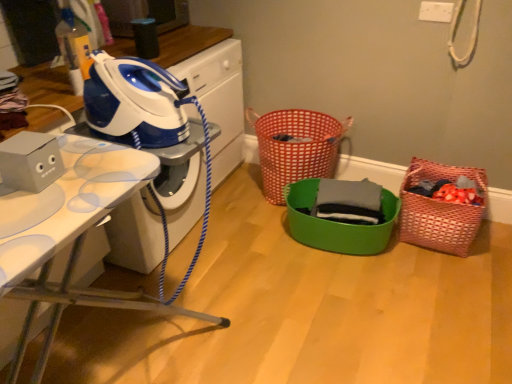
Measure the distance between point (439, 239) and camera.

They are 2.10 meters apart.

This screenshot has height=384, width=512. Describe the element at coordinates (440, 210) in the screenshot. I see `woven pink basket at right, positioned as the 1th basket in right-to-left order` at that location.

Describe the element at coordinates (29, 162) in the screenshot. I see `gray matte cardboard box at left, the 2th appliance in the back-to-front sequence` at that location.

What do you see at coordinates (295, 147) in the screenshot? I see `red woven basket at center, the first basket in the left-to-right sequence` at bounding box center [295, 147].

You are a GUI agent. You are given a task and a screenshot of the screen. Output one action in this format:
    pyautogui.click(x=<x>, y=<y>)
    Task: Click on the green plastic basket at center, marked as the 2th basket in a left-to-right arrangement
    The image size is (512, 384).
    Given the screenshot: What is the action you would take?
    pyautogui.click(x=336, y=223)

What is the approximate height of green plastic basket at center, which is the 2th basket from right to left?

11.14 inches.

The height and width of the screenshot is (384, 512). What do you see at coordinates (219, 100) in the screenshot?
I see `blue glossy iron at left` at bounding box center [219, 100].

Image resolution: width=512 pixels, height=384 pixels. Identify the location of blue glossy iron at left. (219, 100).

At what (x,y) coordinates should I click in order to perform the action: click on woven pink basket at right, positioned as the 1th basket in right-to-left order. Please return your answer as a coordinate pair (x, y). Looking at the image, I should click on (440, 210).

Does green plastic basket at center, marked as the 2th basket in a left-to-right arrangement, turn towards blue/white plastic iron at upper left, which appears as the first appliance when viewed from the top?

No, green plastic basket at center, marked as the 2th basket in a left-to-right arrangement, is not oriented towards blue/white plastic iron at upper left, which appears as the first appliance when viewed from the top.

How many degrees apart are the facing directions of green plastic basket at center, which is the 2th basket from right to left, and blue/white plastic iron at upper left, which appears as the 2th appliance when ordered from the bottom?

They differ by 85.5 degrees in their facing directions.

Between point (341, 234) and point (140, 86), which one is positioned in front?

Point (140, 86)

Does green plastic basket at center, which is the 2th basket from right to left, appear on the right side of blue/white plastic iron at upper left, which appears as the first appliance when viewed from the top?

Yes.

Can you confirm if woven pink basket at right, positioned as the 1th basket in right-to-left order, is smaller than gray cotton shirt at center?

Actually, woven pink basket at right, positioned as the 1th basket in right-to-left order, might be larger than gray cotton shirt at center.

Is woven pink basket at right, the third basket viewed from the left, positioned before gray cotton shirt at center?

Yes, it is in front of gray cotton shirt at center.

Looking at this image, are woven pink basket at right, the third basket viewed from the left, and gray cotton shirt at center making contact?

No, woven pink basket at right, the third basket viewed from the left, is not in contact with gray cotton shirt at center.

Is woven pink basket at right, positioned as the 1th basket in right-to-left order, positioned with its back to gray cotton shirt at center?

woven pink basket at right, positioned as the 1th basket in right-to-left order, is not turned away from gray cotton shirt at center.

Considering the points (362, 219) and (333, 222), which point is behind, point (362, 219) or point (333, 222)?

Point (333, 222)

Is gray cotton shirt at center to the left or to the right of green plastic basket at center, which is the 2th basket from right to left, in the image?

In the image, gray cotton shirt at center appears on the right side of green plastic basket at center, which is the 2th basket from right to left.

Between gray cotton shirt at center and green plastic basket at center, which is the 2th basket from right to left, which one is positioned behind?

Positioned behind is gray cotton shirt at center.

Can you confirm if gray cotton shirt at center is smaller than green plastic basket at center, marked as the 2th basket in a left-to-right arrangement?

Yes, gray cotton shirt at center is smaller than green plastic basket at center, marked as the 2th basket in a left-to-right arrangement.

At what (x,y) coordinates should I click in order to perform the action: click on washing machine behind the green plastic basket at center, marked as the 2th basket in a left-to-right arrangement. Please return your answer as a coordinate pair (x, y). This screenshot has height=384, width=512. Looking at the image, I should click on tap(219, 100).

From a real-world perspective, which object rests below the other?

green plastic basket at center, which is the 2th basket from right to left.

Which object is closer to the camera taking this photo, green plastic basket at center, which is the 2th basket from right to left, or blue glossy iron at left?

green plastic basket at center, which is the 2th basket from right to left, is more forward.

Is green plastic basket at center, marked as the 2th basket in a left-to-right arrangement, not near blue glossy iron at left?

No, green plastic basket at center, marked as the 2th basket in a left-to-right arrangement, is not far from blue glossy iron at left.

The width and height of the screenshot is (512, 384). What are the coordinates of `the 1st basket in front of the red woven basket at center, the third basket positioned from the right, counting from the anchor's position` in the screenshot? It's located at (440, 210).

Is red woven basket at center, the third basket positioned from the right, at the left side of woven pink basket at right, positioned as the 1th basket in right-to-left order?

Indeed, red woven basket at center, the third basket positioned from the right, is positioned on the left side of woven pink basket at right, positioned as the 1th basket in right-to-left order.

From the image's perspective, which object appears higher, gray matte cardboard box at left, the 2th appliance from the top, or woven pink basket at right, positioned as the 1th basket in right-to-left order?

gray matte cardboard box at left, the 2th appliance from the top, from the image's perspective.

Looking at this image, would you say woven pink basket at right, the third basket viewed from the left, is part of gray matte cardboard box at left, the 2th appliance in the back-to-front sequence,'s contents?

No, woven pink basket at right, the third basket viewed from the left, is not inside gray matte cardboard box at left, the 2th appliance in the back-to-front sequence.

Considering the relative sizes of gray matte cardboard box at left, the 1th appliance when ordered from front to back, and woven pink basket at right, positioned as the 1th basket in right-to-left order, in the image provided, is gray matte cardboard box at left, the 1th appliance when ordered from front to back, shorter than woven pink basket at right, positioned as the 1th basket in right-to-left order,?

Yes, gray matte cardboard box at left, the 1th appliance when ordered from front to back, is shorter than woven pink basket at right, positioned as the 1th basket in right-to-left order.

Who is bigger, gray matte cardboard box at left, the 2th appliance from the top, or woven pink basket at right, positioned as the 1th basket in right-to-left order?

Bigger between the two is woven pink basket at right, positioned as the 1th basket in right-to-left order.

Which of these two, blue/white plastic iron at upper left, which appears as the 2th appliance when ordered from the bottom, or white glossy ironing board at left, is thinner?

blue/white plastic iron at upper left, which appears as the 2th appliance when ordered from the bottom, is thinner.

From a real-world perspective, which is physically above, blue/white plastic iron at upper left, positioned as the 1th appliance in back-to-front order, or white glossy ironing board at left?

blue/white plastic iron at upper left, positioned as the 1th appliance in back-to-front order.

Which appliance is the 2nd one when counting from the right side of the white glossy ironing board at left? Please provide its 2D coordinates.

[(133, 101)]

Where is `the 2nd appliance above the green plastic basket at center, marked as the 2th basket in a left-to-right arrangement (from the image's perspective)`? Image resolution: width=512 pixels, height=384 pixels. the 2nd appliance above the green plastic basket at center, marked as the 2th basket in a left-to-right arrangement (from the image's perspective) is located at coordinates (133, 101).

Where is `clothing above the woven pink basket at right, the third basket viewed from the left (from a real-world perspective)`? clothing above the woven pink basket at right, the third basket viewed from the left (from a real-world perspective) is located at coordinates (349, 202).

Which object lies further to the anchor point gray matte cardboard box at left, the 2th appliance in the back-to-front sequence, green plastic basket at center, which is the 2th basket from right to left, or blue glossy iron at left?

green plastic basket at center, which is the 2th basket from right to left, is positioned further to the anchor gray matte cardboard box at left, the 2th appliance in the back-to-front sequence.

Estimate the real-world distances between objects in this image. Which object is further from red woven basket at center, the third basket positioned from the right, blue/white plastic iron at upper left, which is counted as the second appliance, starting from the front, or gray matte cardboard box at left, the 2th appliance from the top?

The object further to red woven basket at center, the third basket positioned from the right, is gray matte cardboard box at left, the 2th appliance from the top.

Looking at the image, which one is located further to woven pink basket at right, positioned as the 1th basket in right-to-left order, red woven basket at center, the third basket positioned from the right, or blue glossy iron at left?

blue glossy iron at left is positioned further to the anchor woven pink basket at right, positioned as the 1th basket in right-to-left order.

Which object lies further to the anchor point red woven basket at center, the third basket positioned from the right, white glossy ironing board at left or woven pink basket at right, the third basket viewed from the left?

white glossy ironing board at left.

Estimate the real-world distances between objects in this image. Which object is closer to gray matte cardboard box at left, the 2th appliance in the back-to-front sequence, white glossy ironing board at left or blue glossy iron at left?

white glossy ironing board at left is closer to gray matte cardboard box at left, the 2th appliance in the back-to-front sequence.

Based on their spatial positions, is white glossy ironing board at left or red woven basket at center, the first basket in the left-to-right sequence, closer to blue glossy iron at left?

The object closer to blue glossy iron at left is red woven basket at center, the first basket in the left-to-right sequence.

Looking at the image, which one is located further to blue/white plastic iron at upper left, which is counted as the second appliance, starting from the front, blue glossy iron at left or white glossy ironing board at left?

Based on the image, blue glossy iron at left appears to be further to blue/white plastic iron at upper left, which is counted as the second appliance, starting from the front.

Looking at the image, which one is located further to white glossy ironing board at left, blue glossy iron at left or red woven basket at center, the first basket in the left-to-right sequence?

red woven basket at center, the first basket in the left-to-right sequence, lies further to white glossy ironing board at left than the other object.

This screenshot has width=512, height=384. I want to click on appliance between gray matte cardboard box at left, the 2th appliance from the top, and woven pink basket at right, positioned as the 1th basket in right-to-left order, in the horizontal direction, so click(x=133, y=101).

You are a GUI agent. You are given a task and a screenshot of the screen. Output one action in this format:
    pyautogui.click(x=<x>, y=<y>)
    Task: Click on the clothing between blue/white plastic iron at upper left, which appears as the first appliance when viewed from the top, and red woven basket at center, the third basket positioned from the right, from front to back
    
    Given the screenshot: What is the action you would take?
    pyautogui.click(x=349, y=202)

Locate an element on the screen. The image size is (512, 384). washing machine between gray matte cardboard box at left, which appears as the 1th appliance when ordered from the bottom, and woven pink basket at right, the third basket viewed from the left, in the horizontal direction is located at coordinates (219, 100).

This screenshot has height=384, width=512. I want to click on clothing located between gray matte cardboard box at left, which appears as the 1th appliance when ordered from the bottom, and woven pink basket at right, positioned as the 1th basket in right-to-left order, in the left-right direction, so click(349, 202).